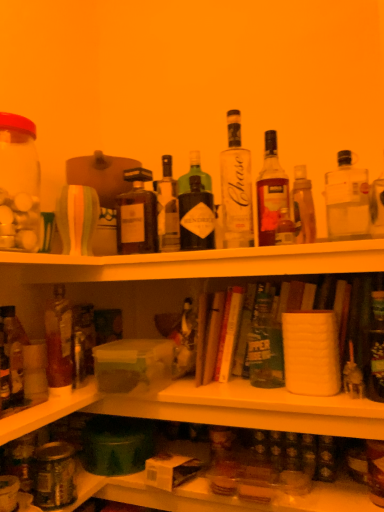
Question: In terms of width, does translucent glass bottle at lower right, which is the 10th bottle from left to right, look wider or thinner when compared to matte glass bottle at center, placed as the 3th bottle when sorted from left to right?

Choices:
 (A) wide
 (B) thin

Answer: (A)

Question: In the image, is translucent glass bottle at lower right, the first bottle when ordered from right to left, positioned in front of or behind matte glass bottle at center, which is the 8th bottle from right to left?

Choices:
 (A) front
 (B) behind

Answer: (A)

Question: Based on their relative distances, which object is nearer to the translucent glass bottle at left, which appears as the ninth bottle when viewed from the right?

Choices:
 (A) matte glass jar at lower left
 (B) translucent glass bottle at upper center, which appears as the third bottle when viewed from the right
 (C) clear glass bottle at upper right, acting as the second bottle starting from the right
 (D) clear glass bottle at center, the sixth bottle when ordered from right to left
 (E) translucent glass bottle at left, which appears as the tenth bottle when viewed from the right

Answer: (E)

Question: Estimate the real-world distances between objects in this image. Which object is farther from the clear glass bottle at upper right, acting as the second bottle starting from the right?

Choices:
 (A) translucent glass bottle at center, arranged as the 7th bottle when viewed from the right
 (B) translucent glass bottle at left, which appears as the tenth bottle when viewed from the right
 (C) green matte beer bottle at center, acting as the 6th bottle starting from the left
 (D) matte glass bottle at center, placed as the 3th bottle when sorted from left to right
 (E) matte glass jar at lower left

Answer: (E)